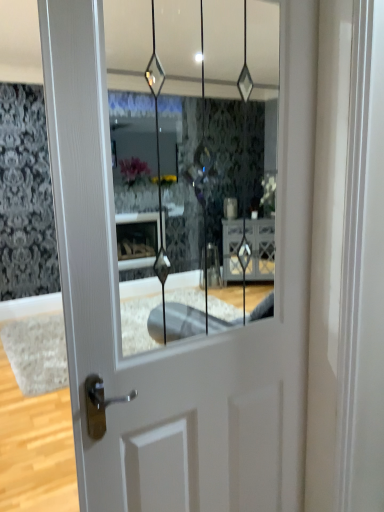
The width and height of the screenshot is (384, 512). What do you see at coordinates (189, 339) in the screenshot?
I see `white glossy door at center` at bounding box center [189, 339].

Image resolution: width=384 pixels, height=512 pixels. Identify the location of white glossy door at center. (189, 339).

Image resolution: width=384 pixels, height=512 pixels. In order to click on white glossy door at center in this screenshot , I will do `click(189, 339)`.